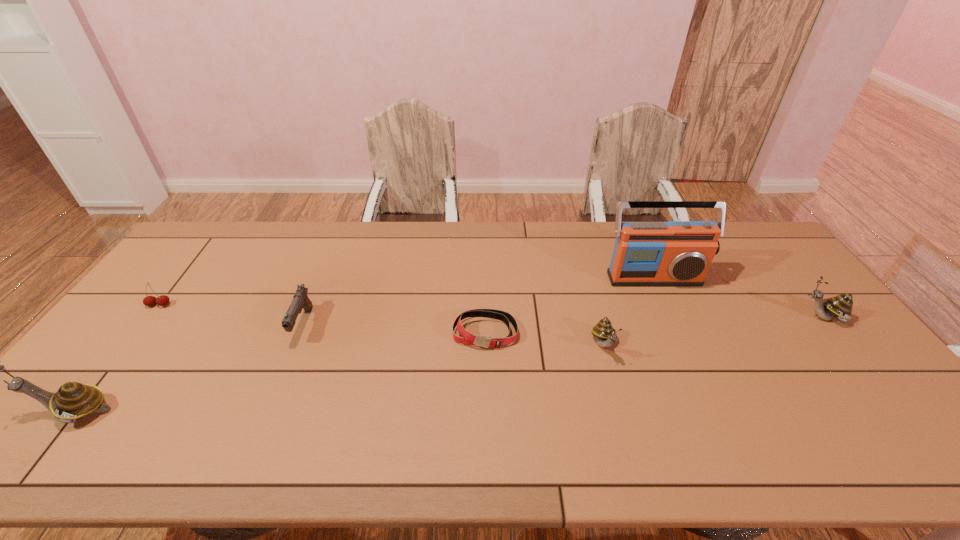
Find the location of a particular element. object present at the near edge is located at coordinates (73, 401).

Locate an element on the screen. The height and width of the screenshot is (540, 960). snail that is at the left edge is located at coordinates (73, 401).

The image size is (960, 540). In order to click on cherry at the left edge in this screenshot , I will do `click(163, 300)`.

I want to click on object that is at the right edge, so click(839, 307).

At what (x,y) coordinates should I click in order to perform the action: click on object located at the near left corner. Please return your answer as a coordinate pair (x, y). Looking at the image, I should click on click(x=73, y=401).

In the image, there is a desktop. Where is `vacant area at the far edge`? This screenshot has height=540, width=960. vacant area at the far edge is located at coordinates (351, 248).

This screenshot has width=960, height=540. What are the coordinates of `free space at the near edge of the desktop` in the screenshot? It's located at (757, 403).

Where is `vacant position at the left edge of the desktop`? The width and height of the screenshot is (960, 540). vacant position at the left edge of the desktop is located at coordinates (180, 282).

In the image, there is a desktop. Identify the location of free space at the right edge. This screenshot has width=960, height=540. (765, 280).

At what (x,y) coordinates should I click in order to perform the action: click on free space between the third object from right to left and the nearest snail. Please return your answer as a coordinate pair (x, y). This screenshot has height=540, width=960. Looking at the image, I should click on (339, 379).